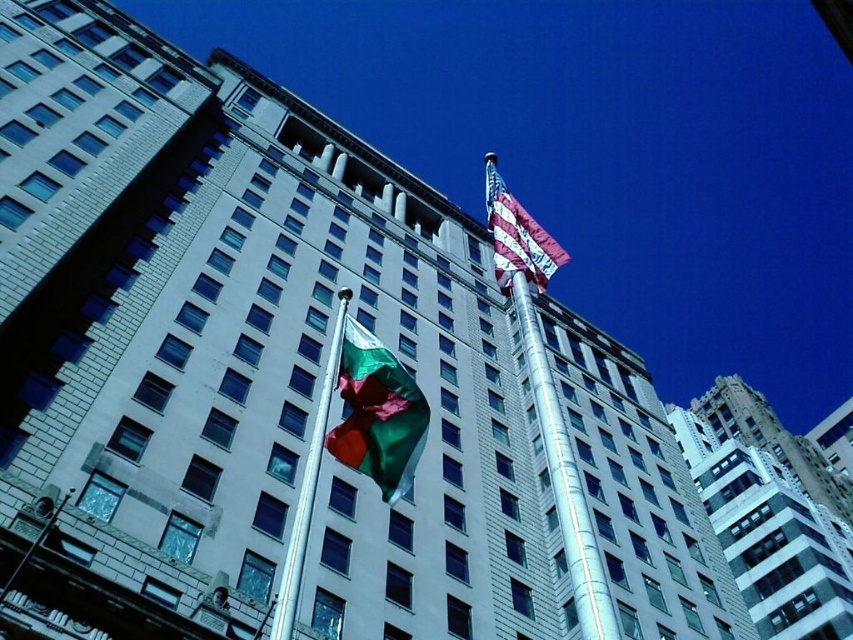
Question: Can you confirm if american flag at upper right is smaller than silver metallic pole at center?

Choices:
 (A) no
 (B) yes

Answer: (A)

Question: Which object is positioned closest to the green fabric flag at center?

Choices:
 (A) silver metallic mast at center
 (B) american flag at upper right
 (C) silver metallic pole at center

Answer: (C)

Question: Can you confirm if american flag at upper right is positioned to the right of silver metallic pole at center?

Choices:
 (A) no
 (B) yes

Answer: (B)

Question: Based on their relative distances, which object is farther from the green fabric flag at center?

Choices:
 (A) silver metallic pole at center
 (B) american flag at upper right

Answer: (B)

Question: Is green fabric flag at center smaller than silver metallic mast at center?

Choices:
 (A) no
 (B) yes

Answer: (B)

Question: Based on their relative distances, which object is farther from the silver metallic mast at center?

Choices:
 (A) silver metallic pole at center
 (B) green fabric flag at center
 (C) american flag at upper right

Answer: (C)